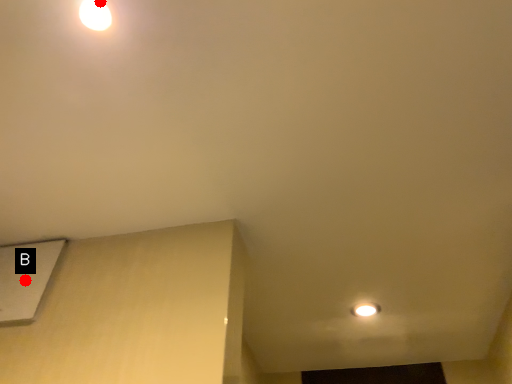
Question: Two points are circled on the image, labeled by A and B beside each circle. Which of the following is the closest to the observer?

Choices:
 (A) A is closer
 (B) B is closer

Answer: (A)